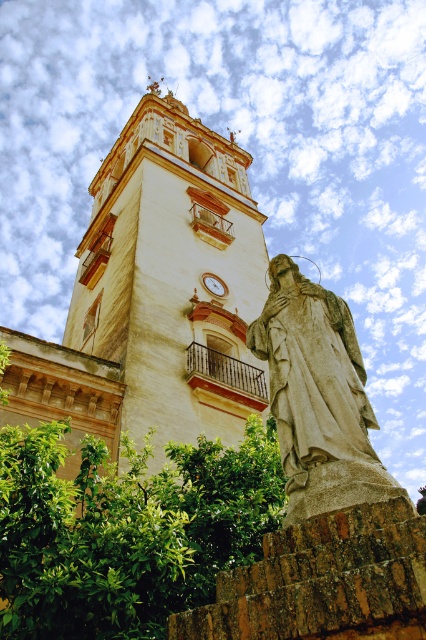
Question: Which of these objects is positioned farthest from the stone statue at center?

Choices:
 (A) beige stone tower at center
 (B) gold metallic clock at center

Answer: (B)

Question: Can you confirm if stone statue at center is bigger than gold metallic clock at center?

Choices:
 (A) no
 (B) yes

Answer: (B)

Question: Can you confirm if beige stone tower at center is thinner than gold metallic clock at center?

Choices:
 (A) yes
 (B) no

Answer: (B)

Question: Which of these objects is positioned farthest from the beige stone tower at center?

Choices:
 (A) stone statue at center
 (B) gold metallic clock at center

Answer: (A)

Question: Is beige stone tower at center above gold metallic clock at center?

Choices:
 (A) yes
 (B) no

Answer: (A)

Question: Which of the following is the closest to the observer?

Choices:
 (A) (210, 291)
 (B) (244, 268)

Answer: (A)